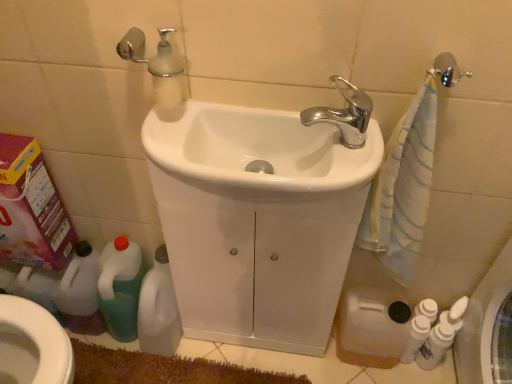
Locate an element on the screen. white glossy sink at center, the 1th sink viewed from the front is located at coordinates (256, 151).

Locate an element on the screen. The height and width of the screenshot is (384, 512). white glossy bottles at lower right, which ranks as the 4th cleaning product in left-to-right order is located at coordinates (435, 346).

Locate an element on the screen. This screenshot has width=512, height=384. green plastic bottle at lower left, the 4th cleaning product positioned from the right is located at coordinates (120, 287).

The width and height of the screenshot is (512, 384). I want to click on pink cardboard box at left, so click(31, 208).

Image resolution: width=512 pixels, height=384 pixels. Find the location of `white glossy sink at center, the 1th sink viewed from the front`. white glossy sink at center, the 1th sink viewed from the front is located at coordinates (256, 151).

From a real-world perspective, which object rests below the other?

From a 3D spatial view, white glossy bottles at lower right, which is counted as the 1th cleaning product, starting from the right, is below.

From the image's perspective, is pink cardboard box at left located beneath white glossy bottles at lower right, which is counted as the 1th cleaning product, starting from the right?

Incorrect, from the image's perspective, pink cardboard box at left is higher than white glossy bottles at lower right, which is counted as the 1th cleaning product, starting from the right.

Considering the positions of points (49, 210) and (423, 364), is point (49, 210) farther from camera compared to point (423, 364)?

No, it is in front of (423, 364).

Does pink cardboard box at left touch white glossy bottles at lower right, which ranks as the 4th cleaning product in left-to-right order?

There is a gap between pink cardboard box at left and white glossy bottles at lower right, which ranks as the 4th cleaning product in left-to-right order.

From the image's perspective, which one is positioned higher, white plastic bottle at lower left, the second cleaning product viewed from the left, or white glossy bidet at lower left?

white plastic bottle at lower left, the second cleaning product viewed from the left.

Measure the distance between white plastic bottle at lower left, the second cleaning product viewed from the left, and white glossy bidet at lower left.

The distance of white plastic bottle at lower left, the second cleaning product viewed from the left, from white glossy bidet at lower left is 12.64 inches.

From a real-world perspective, is white plastic bottle at lower left, positioned as the third cleaning product in right-to-left order, under white glossy bidet at lower left?

Indeed, from a real-world perspective, white plastic bottle at lower left, positioned as the third cleaning product in right-to-left order, is positioned beneath white glossy bidet at lower left.

Does white plastic bottle at lower left, the second cleaning product viewed from the left, turn towards white glossy bidet at lower left?

No, white plastic bottle at lower left, the second cleaning product viewed from the left, is not turned towards white glossy bidet at lower left.

Is white glossy bottles at lower right, which is counted as the 1th cleaning product, starting from the right, next to white glossy sink at center, arranged as the 2th sink when viewed from the front?

white glossy bottles at lower right, which is counted as the 1th cleaning product, starting from the right, and white glossy sink at center, arranged as the 2th sink when viewed from the front, are clearly separated.

Is white glossy bottles at lower right, which ranks as the 4th cleaning product in left-to-right order, facing away from white glossy sink at center, arranged as the 2th sink when viewed from the front?

No, white glossy bottles at lower right, which ranks as the 4th cleaning product in left-to-right order, is not facing the opposite direction of white glossy sink at center, arranged as the 2th sink when viewed from the front.

From the image's perspective, would you say white glossy bottles at lower right, which ranks as the 4th cleaning product in left-to-right order, is positioned over white glossy sink at center, acting as the 1th sink starting from the back?

No, from the image's perspective, white glossy bottles at lower right, which ranks as the 4th cleaning product in left-to-right order, is not above white glossy sink at center, acting as the 1th sink starting from the back.

Looking at the image, does white glossy bottles at lower right, which ranks as the 4th cleaning product in left-to-right order, seem bigger or smaller compared to white glossy sink at center, acting as the 1th sink starting from the back?

white glossy bottles at lower right, which ranks as the 4th cleaning product in left-to-right order, is smaller than white glossy sink at center, acting as the 1th sink starting from the back.

Between pink cardboard box at left and green plastic bottle at lower left, which is the first cleaning product in left-to-right order, which one has larger width?

green plastic bottle at lower left, which is the first cleaning product in left-to-right order.

From the image's perspective, is pink cardboard box at left positioned above or below green plastic bottle at lower left, the 4th cleaning product positioned from the right?

pink cardboard box at left is above green plastic bottle at lower left, the 4th cleaning product positioned from the right.

Between pink cardboard box at left and green plastic bottle at lower left, the 4th cleaning product positioned from the right, which one has smaller size?

With smaller size is green plastic bottle at lower left, the 4th cleaning product positioned from the right.

Is point (41, 162) positioned behind point (121, 276)?

No, it is not.

Is chrome metallic faucet at upper center oriented away from white glossy sink at center, the 1th sink viewed from the front?

chrome metallic faucet at upper center does not have its back to white glossy sink at center, the 1th sink viewed from the front.

Is point (352, 117) behind point (203, 103)?

No, it is in front of (203, 103).

From the image's perspective, which one is positioned higher, chrome metallic faucet at upper center or white glossy sink at center, the 1th sink viewed from the front?

chrome metallic faucet at upper center is shown above in the image.

Looking at this image, is chrome metallic faucet at upper center closer to the viewer compared to white glossy sink at center, the 1th sink viewed from the front?

No, chrome metallic faucet at upper center is further to the viewer.

From the image's perspective, which one is positioned lower, white glossy sink at center, the second sink in the back-to-front sequence, or pink cardboard box at left?

pink cardboard box at left appears lower in the image.

Considering the relative sizes of white glossy sink at center, the 1th sink viewed from the front, and pink cardboard box at left in the image provided, is white glossy sink at center, the 1th sink viewed from the front, taller than pink cardboard box at left?

In fact, white glossy sink at center, the 1th sink viewed from the front, may be shorter than pink cardboard box at left.

Is white glossy sink at center, the second sink in the back-to-front sequence, smaller than pink cardboard box at left?

Yes.

Is white glossy sink at center, the second sink in the back-to-front sequence, positioned beyond the bounds of pink cardboard box at left?

That's correct, white glossy sink at center, the second sink in the back-to-front sequence, is outside of pink cardboard box at left.

Would you say white glossy sink at center, arranged as the 2th sink when viewed from the front, is part of green plastic bottle at lower left, the 4th cleaning product positioned from the right,'s contents?

That's incorrect, white glossy sink at center, arranged as the 2th sink when viewed from the front, is not inside green plastic bottle at lower left, the 4th cleaning product positioned from the right.

Can you confirm if green plastic bottle at lower left, the 4th cleaning product positioned from the right, is taller than white glossy sink at center, acting as the 1th sink starting from the back?

In fact, green plastic bottle at lower left, the 4th cleaning product positioned from the right, may be shorter than white glossy sink at center, acting as the 1th sink starting from the back.

Locate an element on the screen. the 1st sink above the green plastic bottle at lower left, which is the first cleaning product in left-to-right order (from a real-world perspective) is located at coordinates (258, 216).

Measure the distance between green plastic bottle at lower left, the 4th cleaning product positioned from the right, and white glossy sink at center, acting as the 1th sink starting from the back.

green plastic bottle at lower left, the 4th cleaning product positioned from the right, is 17.28 inches from white glossy sink at center, acting as the 1th sink starting from the back.

Identify the location of carton that appears on the left of white glossy bottles at lower right, which is counted as the 1th cleaning product, starting from the right. (31, 208).

This screenshot has height=384, width=512. In order to click on the 1st cleaning product above when counting from the white glossy bidet at lower left (from the image's perspective) in this screenshot , I will do `click(159, 309)`.

Considering their positions, is chrome metallic faucet at upper center positioned further to white glossy bottles at lower right, which is counted as the 3th cleaning product, starting from the left, than green plastic bottle at lower left, the 4th cleaning product positioned from the right?

green plastic bottle at lower left, the 4th cleaning product positioned from the right, is positioned further to the anchor white glossy bottles at lower right, which is counted as the 3th cleaning product, starting from the left.

Looking at the image, which one is located further to white glossy bottles at lower right, which is counted as the 1th cleaning product, starting from the right, white glossy sink at center, arranged as the 2th sink when viewed from the front, or white glossy bottles at lower right, positioned as the second cleaning product in right-to-left order?

white glossy sink at center, arranged as the 2th sink when viewed from the front, is positioned further to the anchor white glossy bottles at lower right, which is counted as the 1th cleaning product, starting from the right.

Estimate the real-world distances between objects in this image. Which object is closer to white glossy bottles at lower right, which is counted as the 3th cleaning product, starting from the left, white glossy bottles at lower right, which is counted as the 1th cleaning product, starting from the right, or green plastic bottle at lower left, the 4th cleaning product positioned from the right?

white glossy bottles at lower right, which is counted as the 1th cleaning product, starting from the right, is closer to white glossy bottles at lower right, which is counted as the 3th cleaning product, starting from the left.

Consider the image. Which object lies nearer to the anchor point white glossy sink at center, the second sink in the back-to-front sequence, chrome metallic faucet at upper center or pink cardboard box at left?

chrome metallic faucet at upper center lies closer to white glossy sink at center, the second sink in the back-to-front sequence, than the other object.

Estimate the real-world distances between objects in this image. Which object is further from white plastic bottle at lower left, positioned as the third cleaning product in right-to-left order, white glossy sink at center, the second sink in the back-to-front sequence, or white glossy bidet at lower left?

white glossy sink at center, the second sink in the back-to-front sequence, lies further to white plastic bottle at lower left, positioned as the third cleaning product in right-to-left order, than the other object.

Which object lies further to the anchor point pink cardboard box at left, green plastic bottle at lower left, the 4th cleaning product positioned from the right, or white glossy sink at center, the 1th sink viewed from the front?

white glossy sink at center, the 1th sink viewed from the front, lies further to pink cardboard box at left than the other object.

Based on their spatial positions, is white glossy bottles at lower right, which ranks as the 4th cleaning product in left-to-right order, or pink cardboard box at left further from white glossy bidet at lower left?

white glossy bottles at lower right, which ranks as the 4th cleaning product in left-to-right order, is positioned further to the anchor white glossy bidet at lower left.

When comparing their distances from chrome metallic faucet at upper center, does pink cardboard box at left or white glossy sink at center, the second sink in the back-to-front sequence, seem further?

pink cardboard box at left is positioned further to the anchor chrome metallic faucet at upper center.

Where is `tap situated between pink cardboard box at left and white glossy bottles at lower right, which is counted as the 3th cleaning product, starting from the left, from left to right`? tap situated between pink cardboard box at left and white glossy bottles at lower right, which is counted as the 3th cleaning product, starting from the left, from left to right is located at coordinates (344, 114).

In order to click on cleaning product between white glossy sink at center, the 1th sink viewed from the front, and green plastic bottle at lower left, the 4th cleaning product positioned from the right, in the front-back direction in this screenshot , I will do `click(159, 309)`.

Where is `tap located between white plastic bottle at lower left, positioned as the third cleaning product in right-to-left order, and white glossy bottles at lower right, which ranks as the 4th cleaning product in left-to-right order, in the left-right direction`? tap located between white plastic bottle at lower left, positioned as the third cleaning product in right-to-left order, and white glossy bottles at lower right, which ranks as the 4th cleaning product in left-to-right order, in the left-right direction is located at coordinates (344, 114).

In order to click on tap located between white glossy bidet at lower left and white glossy bottles at lower right, which is counted as the 1th cleaning product, starting from the right, in the left-right direction in this screenshot , I will do `click(344, 114)`.